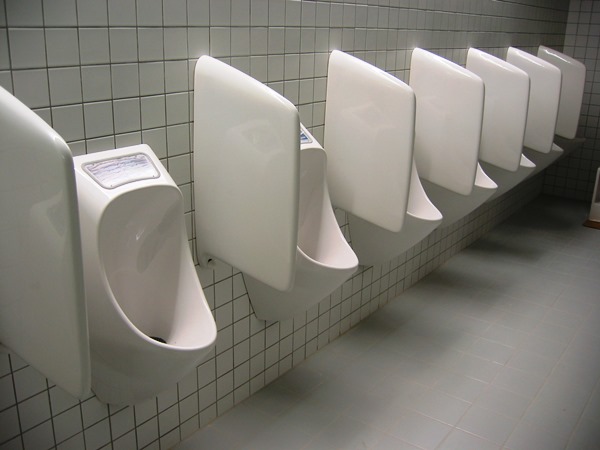
Image resolution: width=600 pixels, height=450 pixels. I want to click on white things in between the urinals, so click(x=575, y=74), click(x=552, y=90), click(x=516, y=92), click(x=455, y=109), click(x=364, y=126), click(x=243, y=138), click(x=37, y=157).